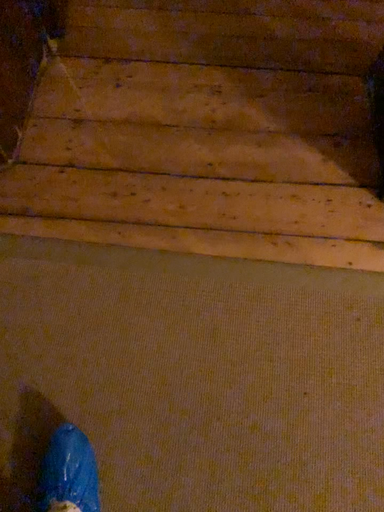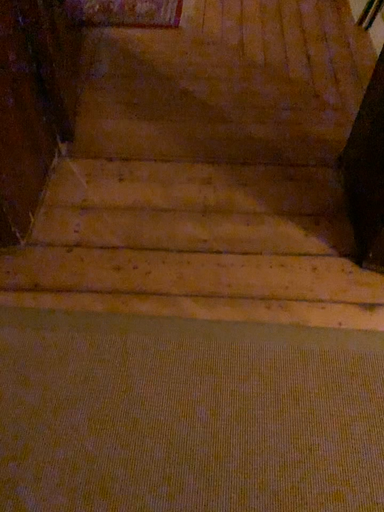
Question: Which way did the camera rotate in the video?

Choices:
 (A) rotated downward
 (B) rotated upward

Answer: (B)